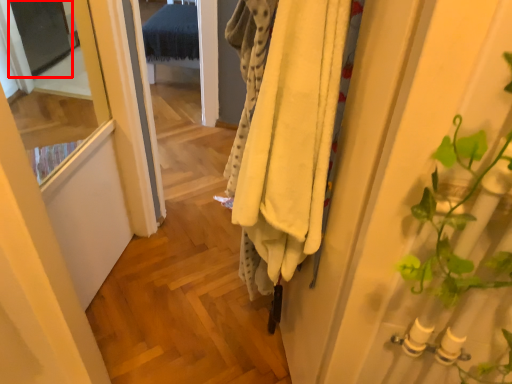
Question: From the image's perspective, where is screen door (annotated by the red box) located in relation to clothing in the image?

Choices:
 (A) above
 (B) below

Answer: (A)